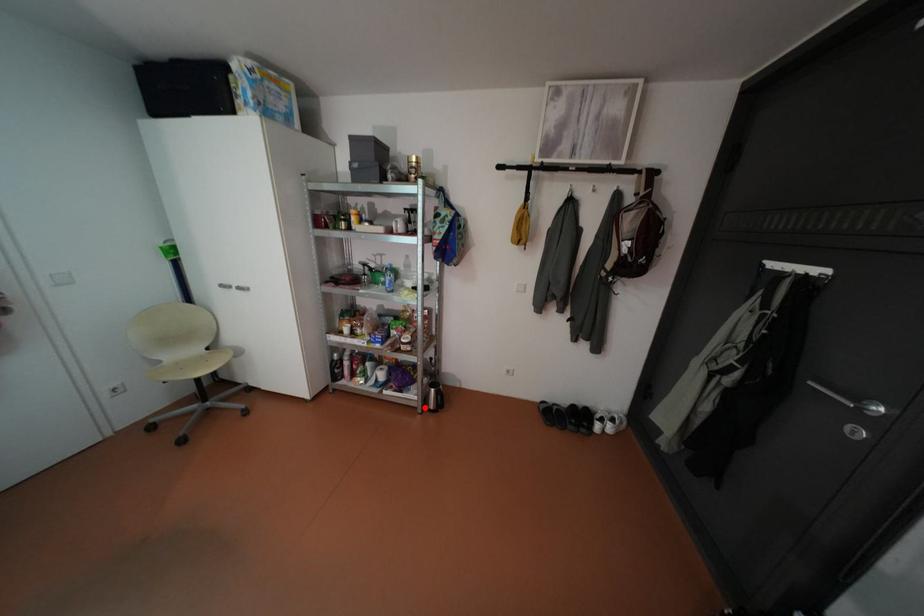
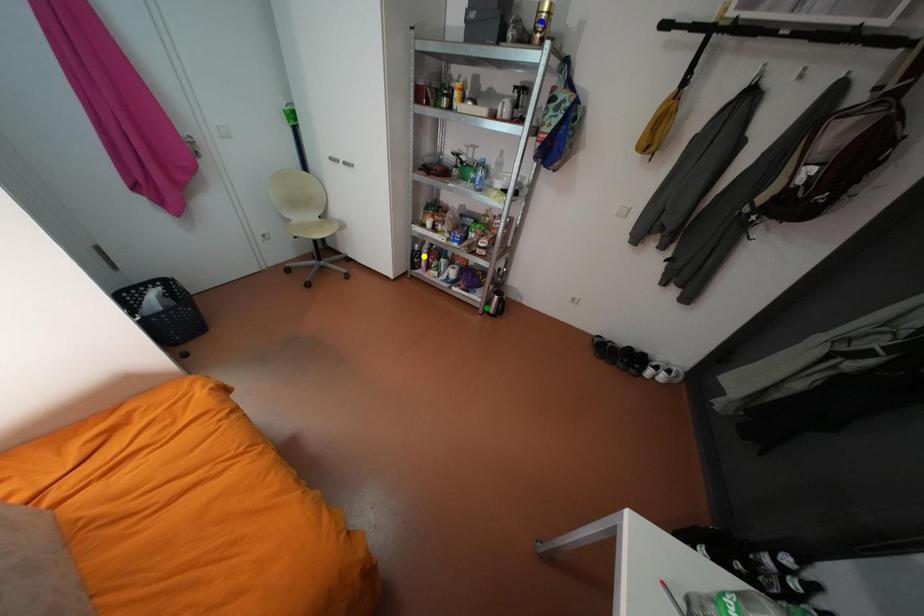
Question: I am providing you with two images of the same scene from different viewpoints. A red point is marked on the first image. You are given multiple points on the second image. In image 2, which mark is for the same physical point as the one in image 1?

Choices:
 (A) green point
 (B) blue point
 (C) yellow point

Answer: (A)